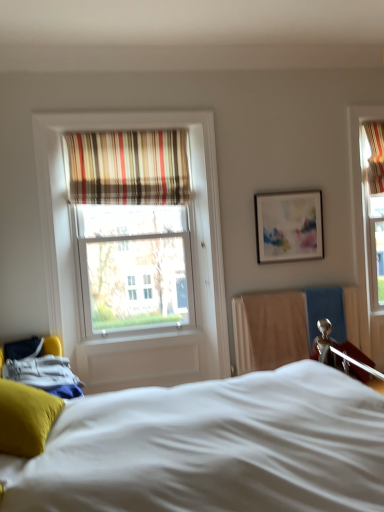
What is the approximate height of matte white picture frame at upper right?

It is 25.30 inches.

The height and width of the screenshot is (512, 384). What are the coordinates of `striped fabric curtain at upper center` in the screenshot? It's located at (127, 167).

Is matte white picture frame at upper right with soft yellow pillow at lower left?

No, matte white picture frame at upper right is not next to soft yellow pillow at lower left.

Is matte white picture frame at upper right completely or partially outside of soft yellow pillow at lower left?

Absolutely, matte white picture frame at upper right is external to soft yellow pillow at lower left.

Considering the relative positions of matte white picture frame at upper right and soft yellow pillow at lower left in the image provided, is matte white picture frame at upper right to the left of soft yellow pillow at lower left from the viewer's perspective?

No, matte white picture frame at upper right is not to the left of soft yellow pillow at lower left.

How much distance is there between white soft bed at center and striped fabric curtain at upper center?

white soft bed at center is 2.28 meters away from striped fabric curtain at upper center.

At what (x,y) coordinates should I click in order to perform the action: click on bed below the striped fabric curtain at upper center (from the image's perspective). Please return your answer as a coordinate pair (x, y). This screenshot has width=384, height=512. Looking at the image, I should click on (212, 448).

Looking at this image, what's the angular difference between white soft bed at center and striped fabric curtain at upper center's facing directions?

There is a 89.6-degree angle between the facing directions of white soft bed at center and striped fabric curtain at upper center.

In terms of height, does white soft bed at center look taller or shorter compared to striped fabric curtain at upper center?

Clearly, white soft bed at center is taller compared to striped fabric curtain at upper center.

From the image's perspective, which one is positioned lower, white soft bed at center or soft yellow pillow at lower left?

white soft bed at center is shown below in the image.

Looking at this image, is white soft bed at center facing away from soft yellow pillow at lower left?

Yes, white soft bed at center's orientation is away from soft yellow pillow at lower left.

Considering the relative sizes of white soft bed at center and soft yellow pillow at lower left in the image provided, is white soft bed at center bigger than soft yellow pillow at lower left?

Yes, white soft bed at center is bigger than soft yellow pillow at lower left.

Is white soft bed at center positioned behind soft yellow pillow at lower left?

No, the depth of white soft bed at center is less than that of soft yellow pillow at lower left.

Does striped fabric curtain at upper center contain matte white picture frame at upper right?

Definitely not — matte white picture frame at upper right is not inside striped fabric curtain at upper center.

Is striped fabric curtain at upper center turned away from matte white picture frame at upper right?

No, matte white picture frame at upper right is not at the back of striped fabric curtain at upper center.

Which of these two, striped fabric curtain at upper center or matte white picture frame at upper right, stands taller?

With more height is striped fabric curtain at upper center.

Is soft yellow pillow at lower left taller than striped fabric curtain at upper center?

In fact, soft yellow pillow at lower left may be shorter than striped fabric curtain at upper center.

Considering the positions of points (21, 414) and (153, 180), is point (21, 414) closer to camera compared to point (153, 180)?

Yes, point (21, 414) is in front of point (153, 180).

Is soft yellow pillow at lower left aimed at striped fabric curtain at upper center?

No.

From the picture: Is soft yellow pillow at lower left at the right side of striped fabric curtain at upper center?

In fact, soft yellow pillow at lower left is to the left of striped fabric curtain at upper center.

Considering the positions of points (166, 202) and (300, 500), is point (166, 202) farther from camera compared to point (300, 500)?

Yes.

Can you tell me how much striped fabric curtain at upper center and white soft bed at center differ in facing direction?

89.6 degrees separate the facing orientations of striped fabric curtain at upper center and white soft bed at center.

From a real-world perspective, is striped fabric curtain at upper center beneath white soft bed at center?

No, from a real-world perspective, striped fabric curtain at upper center is not beneath white soft bed at center.

Considering the relative positions of striped fabric curtain at upper center and white soft bed at center in the image provided, is striped fabric curtain at upper center to the left or to the right of white soft bed at center?

striped fabric curtain at upper center is to the left of white soft bed at center.

Does matte white picture frame at upper right have a lesser width compared to white soft bed at center?

Yes, matte white picture frame at upper right is thinner than white soft bed at center.

Considering the sizes of objects matte white picture frame at upper right and white soft bed at center in the image provided, who is smaller, matte white picture frame at upper right or white soft bed at center?

Smaller between the two is matte white picture frame at upper right.

Is matte white picture frame at upper right oriented towards white soft bed at center?

No, matte white picture frame at upper right is not turned towards white soft bed at center.

This screenshot has height=512, width=384. I want to click on picture frame behind the soft yellow pillow at lower left, so click(289, 226).

This screenshot has height=512, width=384. I want to click on bed located below the striped fabric curtain at upper center (from the image's perspective), so click(212, 448).

Estimate the real-world distances between objects in this image. Which object is closer to white soft bed at center, soft yellow pillow at lower left or matte white picture frame at upper right?

soft yellow pillow at lower left is closer to white soft bed at center.

Estimate the real-world distances between objects in this image. Which object is further from matte white picture frame at upper right, white soft bed at center or striped fabric curtain at upper center?

white soft bed at center lies further to matte white picture frame at upper right than the other object.

Estimate the real-world distances between objects in this image. Which object is further from striped fabric curtain at upper center, soft yellow pillow at lower left or matte white picture frame at upper right?

soft yellow pillow at lower left is positioned further to the anchor striped fabric curtain at upper center.

Looking at the image, which one is located further to matte white picture frame at upper right, striped fabric curtain at upper center or soft yellow pillow at lower left?

soft yellow pillow at lower left is further to matte white picture frame at upper right.

From the image, which object appears to be nearer to striped fabric curtain at upper center, white soft bed at center or matte white picture frame at upper right?

matte white picture frame at upper right lies closer to striped fabric curtain at upper center than the other object.

When comparing their distances from soft yellow pillow at lower left, does white soft bed at center or matte white picture frame at upper right seem further?

matte white picture frame at upper right is further to soft yellow pillow at lower left.

Which object lies further to the anchor point striped fabric curtain at upper center, matte white picture frame at upper right or white soft bed at center?

white soft bed at center lies further to striped fabric curtain at upper center than the other object.

Considering their positions, is matte white picture frame at upper right positioned further to soft yellow pillow at lower left than white soft bed at center?

matte white picture frame at upper right.

Where is `pillow between white soft bed at center and striped fabric curtain at upper center along the z-axis`? The height and width of the screenshot is (512, 384). pillow between white soft bed at center and striped fabric curtain at upper center along the z-axis is located at coordinates (26, 418).

The image size is (384, 512). I want to click on curtain located between white soft bed at center and matte white picture frame at upper right in the depth direction, so click(127, 167).

Find the location of `curtain between soft yellow pillow at lower left and matte white picture frame at upper right in the front-back direction`. curtain between soft yellow pillow at lower left and matte white picture frame at upper right in the front-back direction is located at coordinates (127, 167).

Locate an element on the screen. This screenshot has height=512, width=384. pillow between white soft bed at center and matte white picture frame at upper right along the z-axis is located at coordinates click(x=26, y=418).